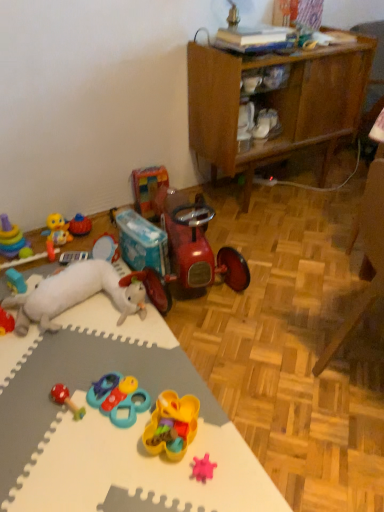
Locate an element on the screen. free space above white foam mat at lower left (from a real-world perspective) is located at coordinates [93, 397].